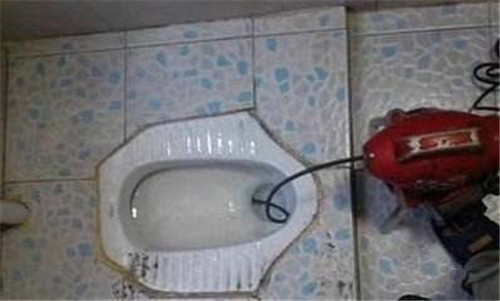
What are the coordinates of `toilet` in the screenshot? It's located at (194, 187).